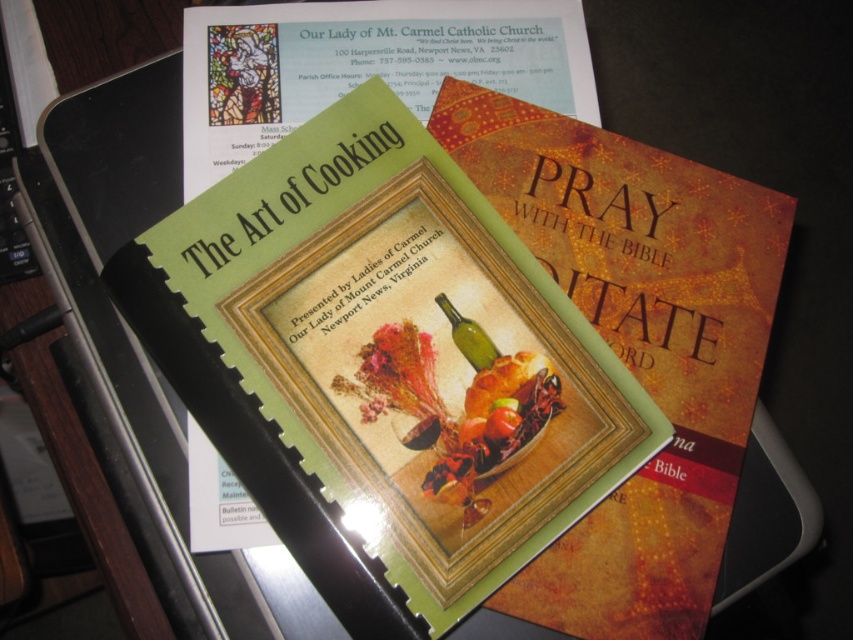
You are organizing a small display on the desk. You have a green matte paper at center and a green glass wine bottle at center. Which item should you place first if you want to prioritize larger items?

You should place the green matte paper at center first because it has a larger size compared to the green glass wine bottle at center.

Based on the photo, you are organizing items on a desk and see the green matte paper at center and the green glass wine bottle at center. Which item is located to the left of the other?

The green matte paper at center is positioned on the left side of the green glass wine bottle at center.

Based on the photo, you are a student who needs to place a 12 inch ruler on the desk. The green matte paper at center is currently occupying space. Can you place the ruler horizontally on the desk without overlapping the paper?

The green matte paper at center and viewer are 18.07 inches apart from each other. Since the ruler is 12 inches long, there is enough space to place it horizontally on the desk without overlapping the paper.